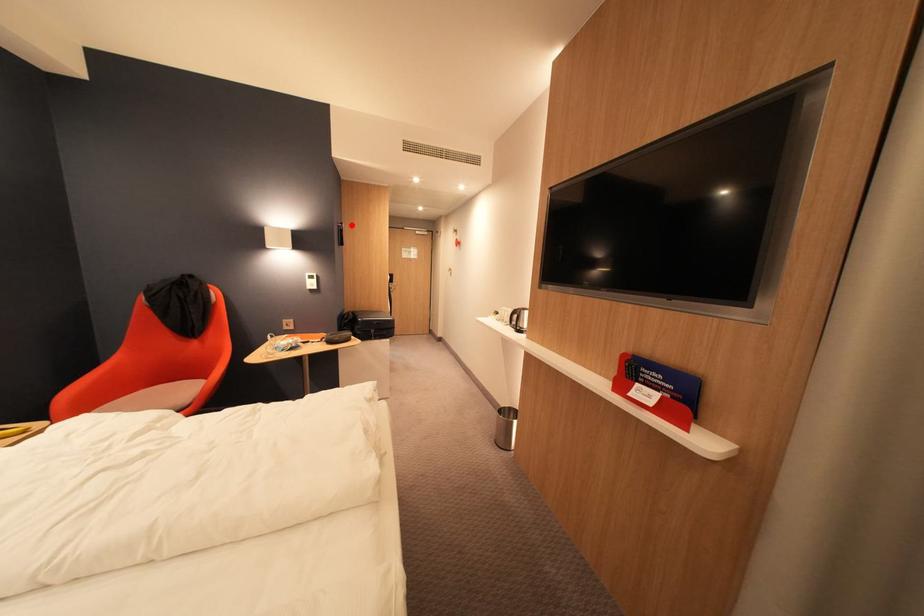
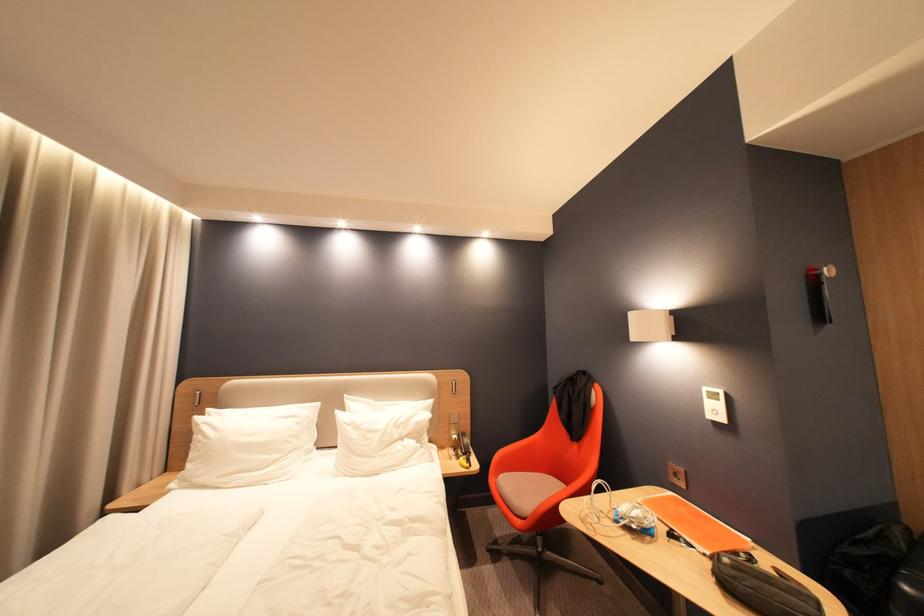
Question: I am providing you with two images of the same scene from different viewpoints. A red point is marked on the first image. At the location where the point appears in image 1, is it still visible in image 2?

Choices:
 (A) Yes
 (B) No

Answer: (A)